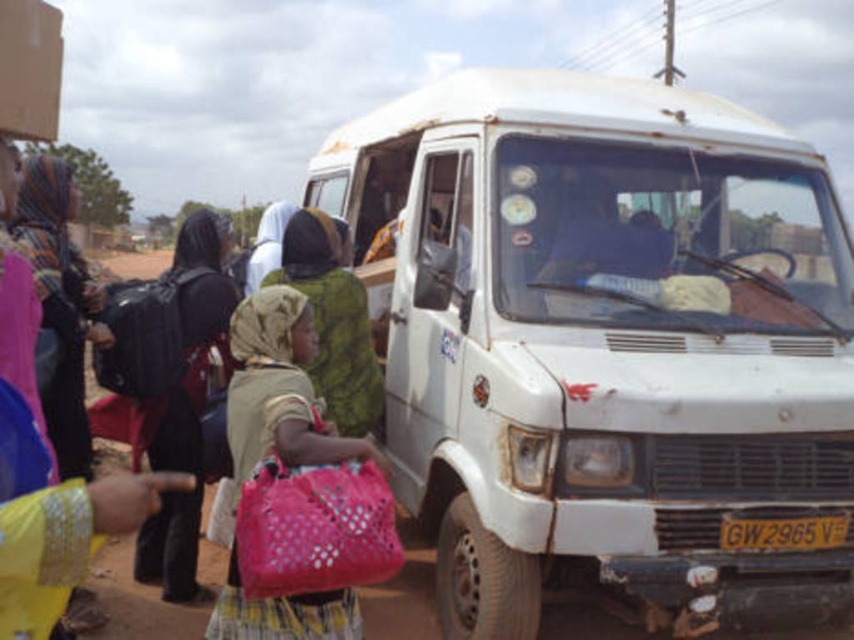
You are a traveler who just arrived at the van. You see a green fabric headscarf at center and a cardboard box at upper left. Which object is closer to you?

The green fabric headscarf at center is closer to you because it is further to the viewer than the cardboard box at upper left.

You are a traveler who just arrived at the scene and want to retrieve your luggage. You have a black fabric backpack at left and a cardboard box at upper left. Which item is closer to you?

The black fabric backpack at left is closer to you because it is further to the viewer than the cardboard box at upper left.

You are standing in front of the van and want to reach both the point marked at coordinates point (326, 401) and the point marked at coordinates point (1, 44). Which point will you reach first?

You will reach point (1, 44) first because it is closer to you than point (326, 401), which is further away.